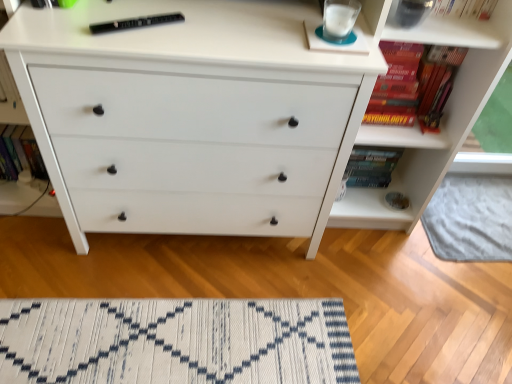
Find the location of a particular element. The height and width of the screenshot is (384, 512). vacant point above white matte chest of drawers at center (from a real-world perspective) is located at coordinates (x=195, y=18).